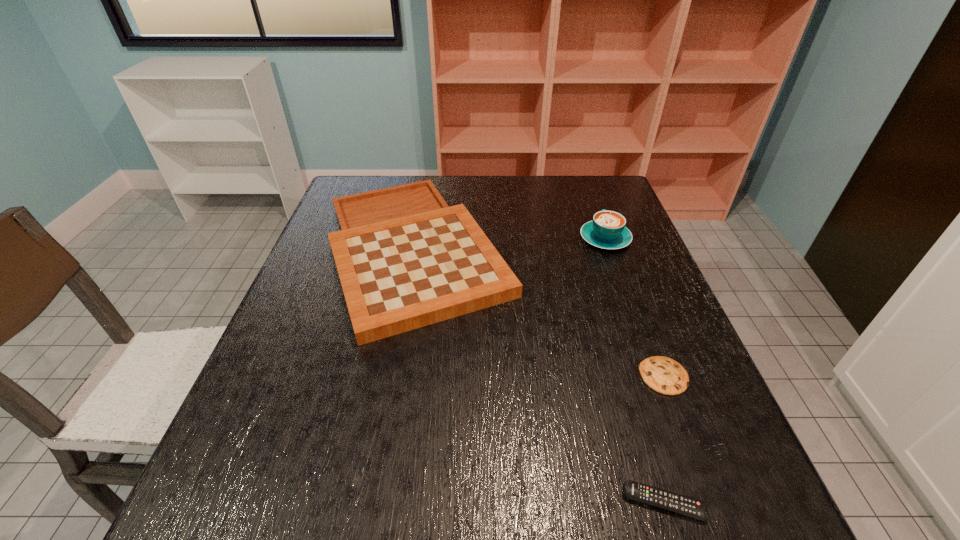
I want to click on vacant space in between the gameboard and the cappuccino, so click(x=510, y=245).

The width and height of the screenshot is (960, 540). What are the coordinates of `empty location between the cookie and the tallest object` in the screenshot? It's located at (635, 308).

The image size is (960, 540). Identify the location of vacant area between the nearest object and the gameboard. (540, 376).

Image resolution: width=960 pixels, height=540 pixels. In order to click on empty space that is in between the third farthest object and the remote control in this screenshot , I will do `click(663, 440)`.

Identify which object is the second closest to the cookie. Please provide its 2D coordinates. Your answer should be formatted as a tuple, i.e. [(x, y)], where the tuple contains the x and y coordinates of a point satisfying the conditions above.

[(405, 259)]

Locate an element on the screen. object that stands as the third closest to the leftmost object is located at coordinates (677, 503).

Image resolution: width=960 pixels, height=540 pixels. In order to click on vacant region that satisfies the following two spatial constraints: 1. on the front side of the gameboard; 2. on the left side of the remote control in this screenshot , I will do `click(370, 502)`.

Locate an element on the screen. free space that satisfies the following two spatial constraints: 1. on the back side of the cookie; 2. on the left side of the nearest object is located at coordinates (626, 376).

Locate an element on the screen. Image resolution: width=960 pixels, height=540 pixels. free space that satisfies the following two spatial constraints: 1. on the front side of the remote control; 2. on the right side of the third shortest object is located at coordinates (370, 502).